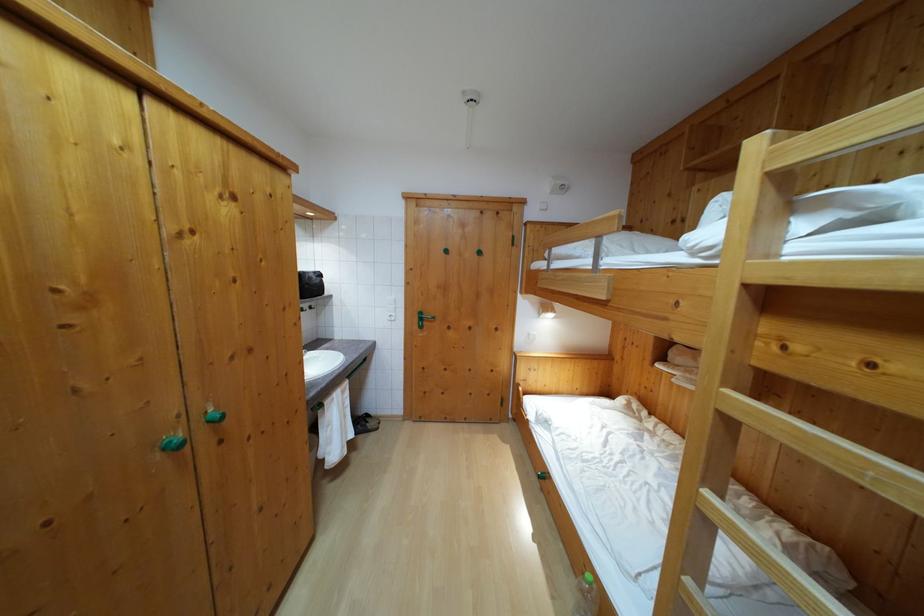
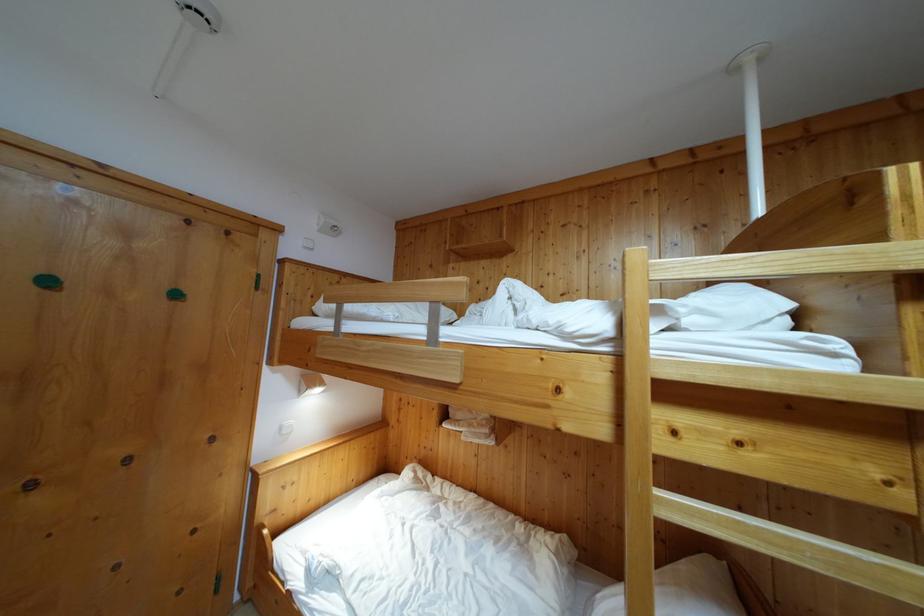
Find the pixel in the second image that matches (539,301) in the first image.

(310, 374)